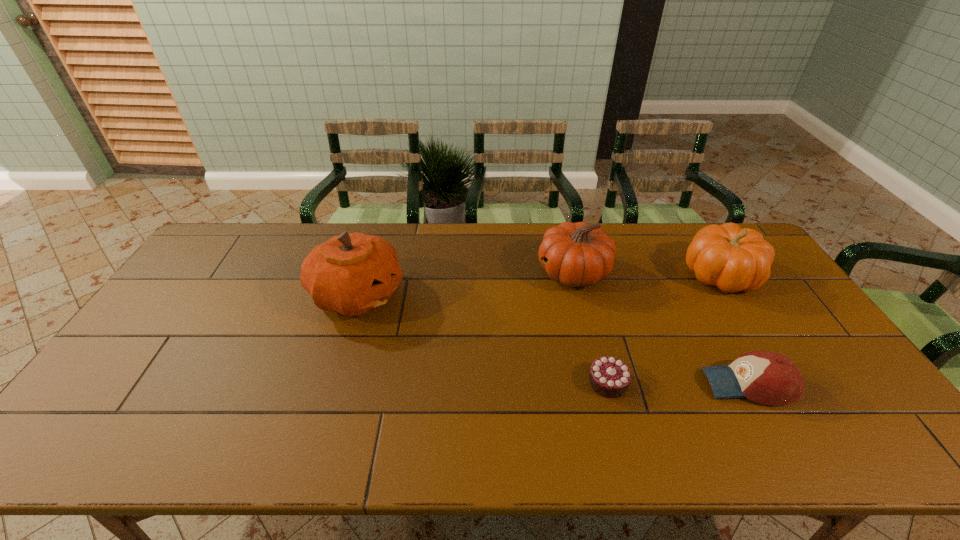
Image resolution: width=960 pixels, height=540 pixels. Identify the location of free space that is in between the second shortest object and the rightmost pumpkin. (734, 329).

The height and width of the screenshot is (540, 960). In order to click on free spot between the baseball cap and the rightmost pumpkin in this screenshot , I will do `click(734, 329)`.

At what (x,y) coordinates should I click in order to perform the action: click on free space between the fourth tallest object and the tallest pumpkin. Please return your answer as a coordinate pair (x, y). Looking at the image, I should click on (553, 340).

Identify which object is the fourth nearest to the baseball cap. Please provide its 2D coordinates. Your answer should be formatted as a tuple, i.e. [(x, y)], where the tuple contains the x and y coordinates of a point satisfying the conditions above.

[(351, 274)]

Where is `object that is the nearest to the leftmost object`? object that is the nearest to the leftmost object is located at coordinates (578, 255).

Select which pumpkin appears as the second closest to the shortest object. Please provide its 2D coordinates. Your answer should be formatted as a tuple, i.e. [(x, y)], where the tuple contains the x and y coordinates of a point satisfying the conditions above.

[(732, 258)]

Identify which pumpkin is located as the nearest to the rightmost pumpkin. Please provide its 2D coordinates. Your answer should be formatted as a tuple, i.e. [(x, y)], where the tuple contains the x and y coordinates of a point satisfying the conditions above.

[(578, 255)]

The height and width of the screenshot is (540, 960). I want to click on free location that satisfies the following two spatial constraints: 1. on the face of the chocolate cake; 2. on the left side of the second pumpkin from right to left, so click(x=600, y=382).

You are a GUI agent. You are given a task and a screenshot of the screen. Output one action in this format:
    pyautogui.click(x=<x>, y=<y>)
    Task: Click on the free space in the image that satisfies the following two spatial constraints: 1. on the front-facing side of the chocolate cake; 2. on the left side of the tallest pumpkin
    Image resolution: width=960 pixels, height=540 pixels.
    Given the screenshot: What is the action you would take?
    [330, 382]

You are a GUI agent. You are given a task and a screenshot of the screen. Output one action in this format:
    pyautogui.click(x=<x>, y=<y>)
    Task: Click on the free spot that satisfies the following two spatial constraints: 1. on the face of the second pumpkin from right to left; 2. on the left side of the rightmost pumpkin
    This screenshot has width=960, height=540.
    Given the screenshot: What is the action you would take?
    pyautogui.click(x=574, y=275)